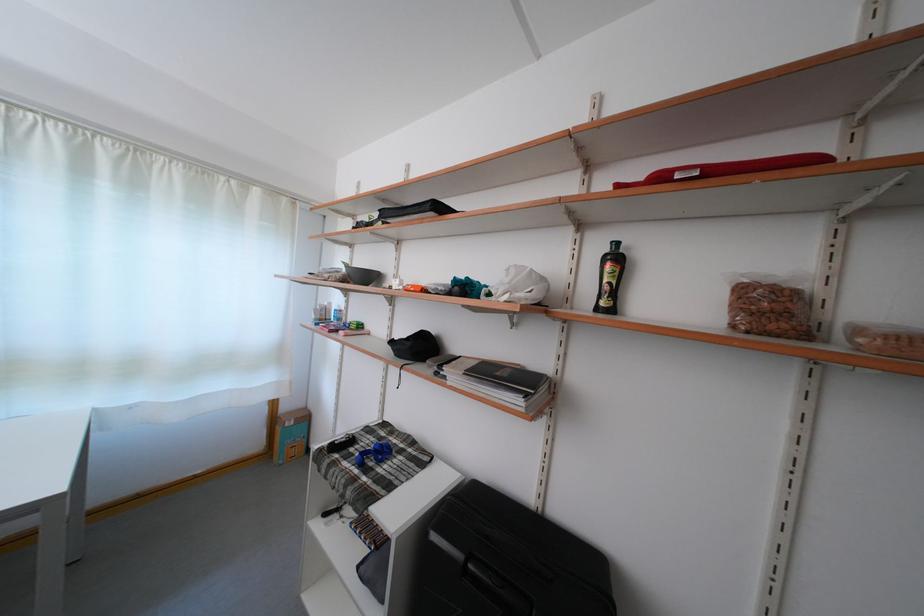
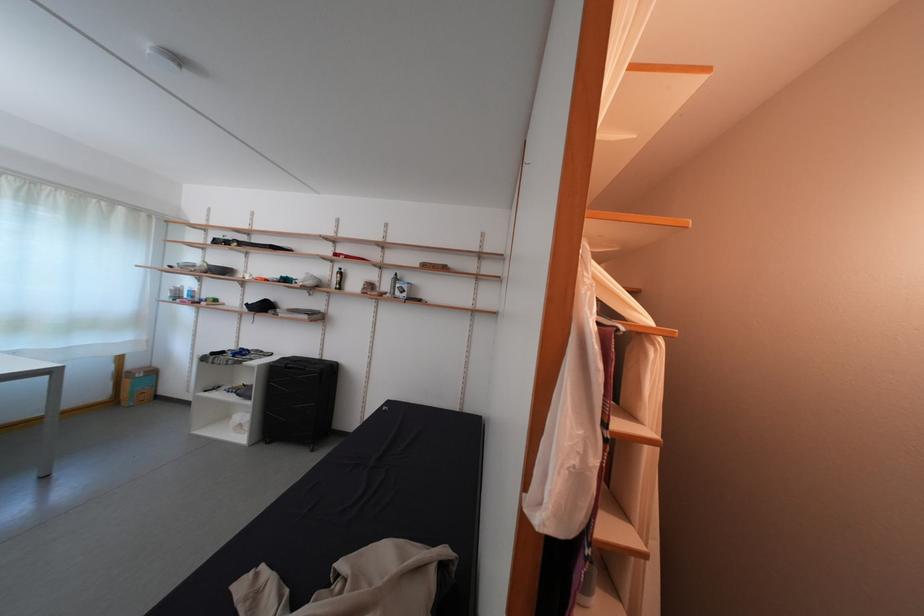
The point at (x=581, y=292) is marked in the first image. Where is the corresponding point in the second image?

(339, 286)